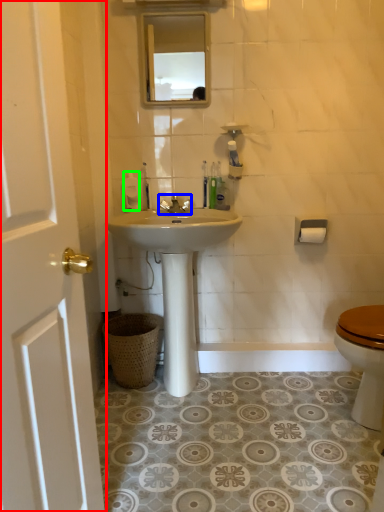
Question: Which object is the farthest from door (highlighted by a red box)? Choose among these: faucet (highlighted by a blue box) or toiletries (highlighted by a green box).

Choices:
 (A) faucet
 (B) toiletries

Answer: (A)